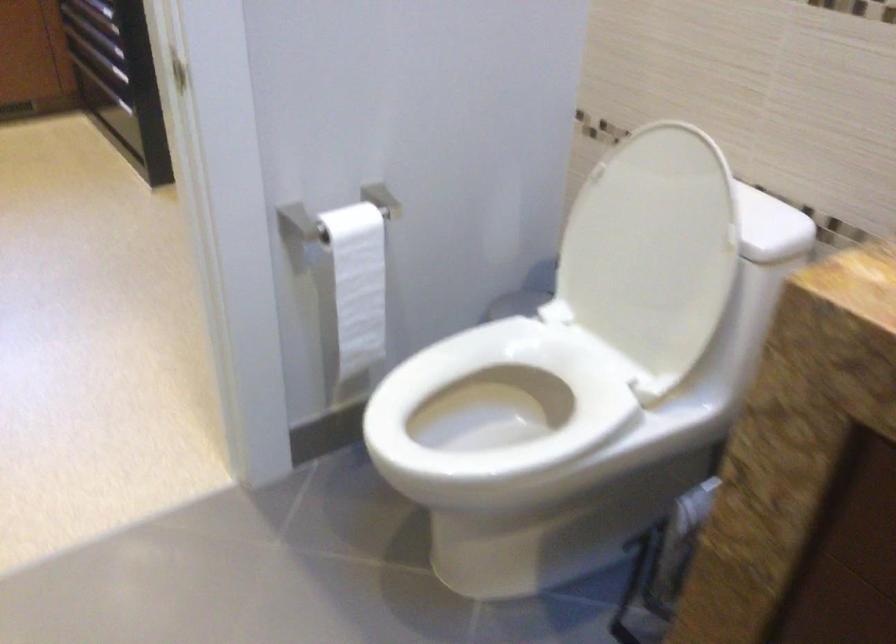
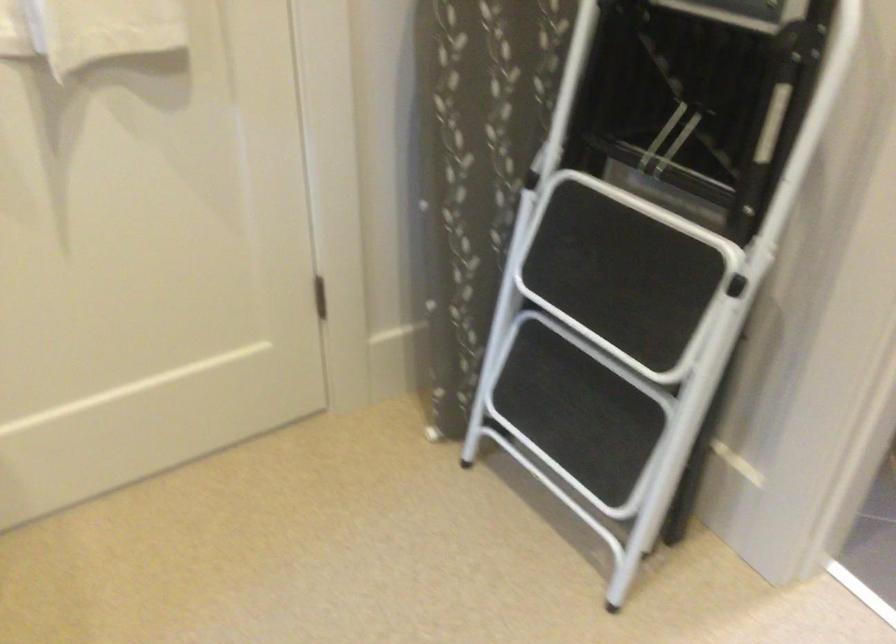
The point at [332,116] is marked in the first image. Where is the corresponding point in the second image?

(658, 216)